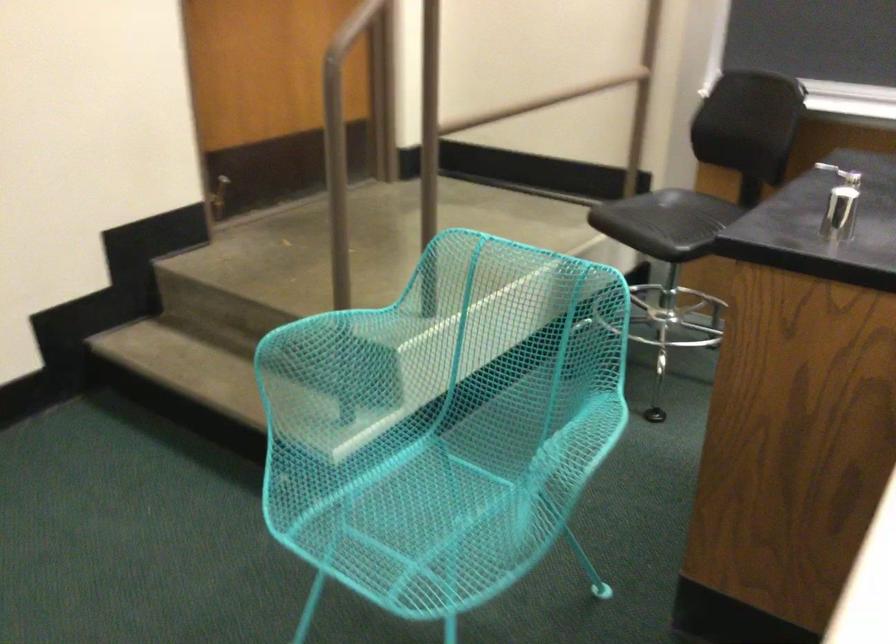
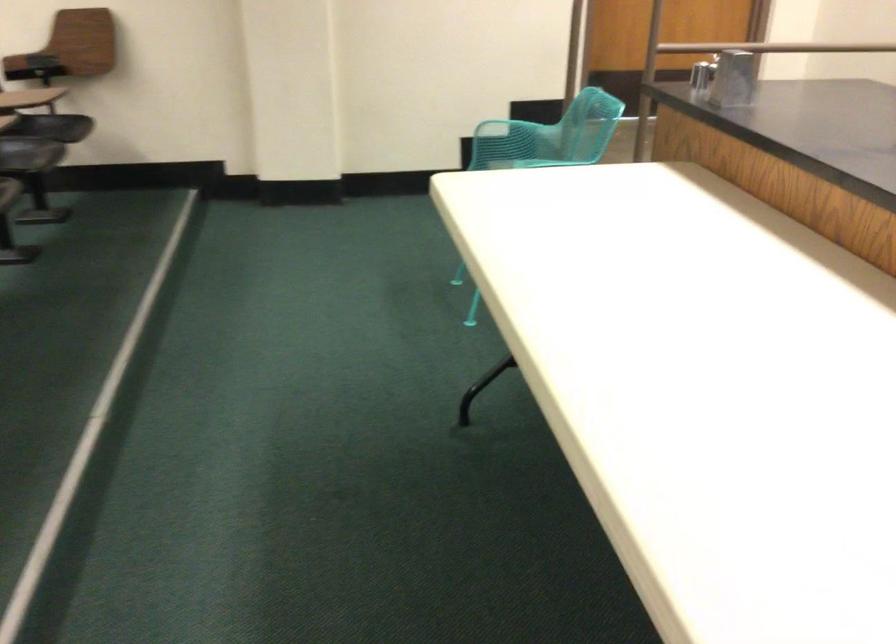
Where in the second image is the point corresponding to [280,395] from the first image?

(489, 158)